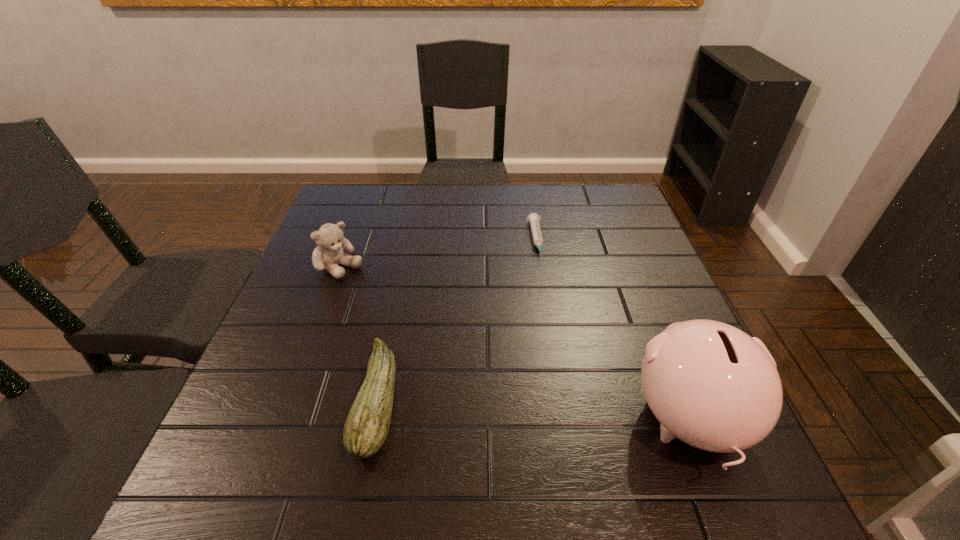
This screenshot has height=540, width=960. I want to click on zucchini, so click(366, 428).

I want to click on the second object from left to right, so click(x=366, y=428).

The height and width of the screenshot is (540, 960). Identify the location of piggy bank. (709, 384).

Locate an element on the screen. the rightmost object is located at coordinates (709, 384).

The height and width of the screenshot is (540, 960). What are the coordinates of `the third shortest object` in the screenshot? It's located at (330, 239).

Locate an element on the screen. The height and width of the screenshot is (540, 960). teddy bear is located at coordinates (330, 239).

Where is `the second object from right to left`? This screenshot has height=540, width=960. the second object from right to left is located at coordinates [x=533, y=218].

This screenshot has height=540, width=960. What are the coordinates of `syringe` in the screenshot? It's located at (533, 218).

This screenshot has width=960, height=540. I want to click on vacant region located 0.110m at the stem end of the second shortest object, so click(300, 399).

I want to click on blank space located at the stem end of the second shortest object, so click(x=305, y=399).